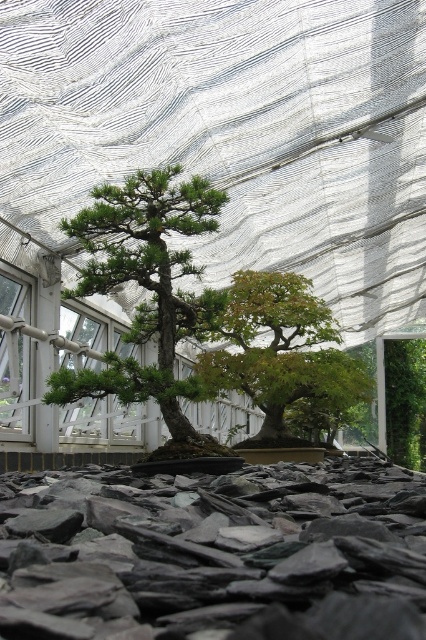
Locate an element on the screen. This screenshot has height=640, width=426. green matte bonsai at center is located at coordinates (146, 289).

Does green matte bonsai at center appear over green glossy bonsai at center?

Yes, green matte bonsai at center is above green glossy bonsai at center.

You are a GUI agent. You are given a task and a screenshot of the screen. Output one action in this format:
    pyautogui.click(x=<x>, y=<y>)
    Task: Click on the green matte bonsai at center
    The image size is (426, 640).
    Given the screenshot: What is the action you would take?
    pyautogui.click(x=146, y=289)

Can you confirm if dark gray slate at center is smaller than green matte bonsai at center?

Actually, dark gray slate at center might be larger than green matte bonsai at center.

Is dark gray slate at center behind green matte bonsai at center?

No, dark gray slate at center is in front of green matte bonsai at center.

Measure the distance between point (115, 584) and camera.

Point (115, 584) is 26.74 inches from camera.

Image resolution: width=426 pixels, height=640 pixels. Find the location of `dark gray slate at center`. dark gray slate at center is located at coordinates (215, 554).

Between dark gray slate at center and green glossy bonsai at center, which one has more height?

green glossy bonsai at center is taller.

Does dark gray slate at center lie behind green glossy bonsai at center?

No, dark gray slate at center is closer to the viewer.

Who is more distant from viewer, (279,636) or (222,378)?

The point (222,378) is behind.

Identify the location of dark gray slate at center. This screenshot has width=426, height=640. (215, 554).